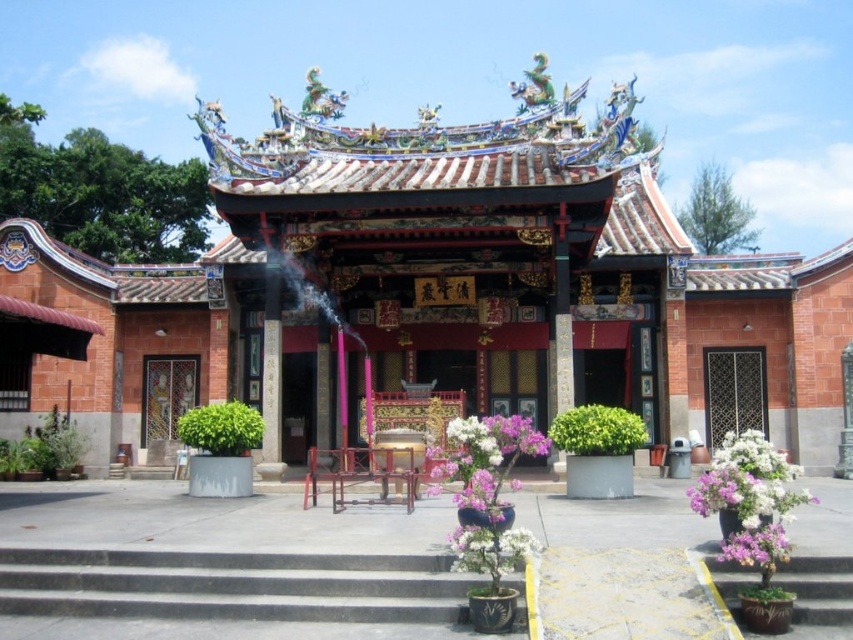
Between purple matte flower pot at lower right and purple matte flowers at lower right, which one appears on the left side from the viewer's perspective?

From the viewer's perspective, purple matte flowers at lower right appears more on the left side.

Who is more forward, (x=708, y=468) or (x=741, y=541)?

Point (x=741, y=541) is in front.

Who is more distant from viewer, (x=766, y=445) or (x=756, y=547)?

Positioned behind is point (x=766, y=445).

The width and height of the screenshot is (853, 640). What are the coordinates of `purple matte flower pot at lower right` in the screenshot? It's located at (749, 499).

Is smooth concrete stairs at lower right thinner than black metal gate at center?

Yes.

Does smooth concrete stairs at lower right come behind black metal gate at center?

No, it is in front of black metal gate at center.

Who is more forward, (786, 576) or (735, 394)?

Point (786, 576) is more forward.

The height and width of the screenshot is (640, 853). What are the coordinates of `smooth concrete stairs at lower right` in the screenshot? It's located at (817, 589).

Between glossy ceramic altar at center and smooth concrete stairs at lower right, which one is positioned lower?

Positioned lower is smooth concrete stairs at lower right.

Can you confirm if glossy ceramic altar at center is thinner than smooth concrete stairs at lower right?

No, glossy ceramic altar at center is not thinner than smooth concrete stairs at lower right.

Describe the element at coordinates (430, 289) in the screenshot. This screenshot has height=640, width=853. I see `glossy ceramic altar at center` at that location.

Locate an element on the screen. glossy ceramic altar at center is located at coordinates (430, 289).